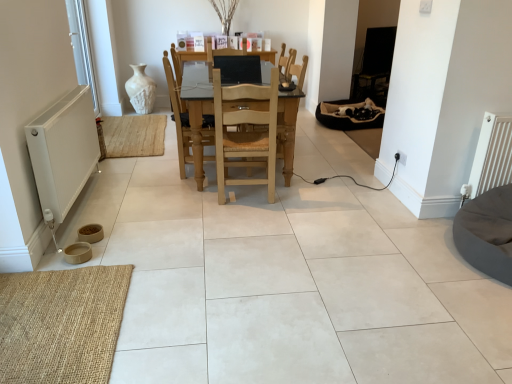
Question: Is the position of white plastic window screen at left less distant than that of burlap mat at lower left?

Choices:
 (A) yes
 (B) no

Answer: (B)

Question: From the image's perspective, is white plastic window screen at left above burlap mat at lower left?

Choices:
 (A) no
 (B) yes

Answer: (B)

Question: Considering the relative sizes of white plastic window screen at left and burlap mat at lower left in the image provided, is white plastic window screen at left smaller than burlap mat at lower left?

Choices:
 (A) yes
 (B) no

Answer: (B)

Question: Is white plastic window screen at left facing towards burlap mat at lower left?

Choices:
 (A) yes
 (B) no

Answer: (B)

Question: Is white plastic window screen at left outside of burlap mat at lower left?

Choices:
 (A) no
 (B) yes

Answer: (B)

Question: Is white plastic window screen at left taller than burlap mat at lower left?

Choices:
 (A) no
 (B) yes

Answer: (B)

Question: Is light wood table at center completely or partially outside of burlap mat at lower left?

Choices:
 (A) no
 (B) yes

Answer: (B)

Question: Does light wood table at center have a smaller size compared to burlap mat at lower left?

Choices:
 (A) no
 (B) yes

Answer: (A)

Question: Is light wood table at center next to burlap mat at lower left and touching it?

Choices:
 (A) yes
 (B) no

Answer: (B)

Question: Can you confirm if light wood table at center is positioned to the left of burlap mat at lower left?

Choices:
 (A) yes
 (B) no

Answer: (B)

Question: Could you tell me if light wood table at center is turned towards burlap mat at lower left?

Choices:
 (A) yes
 (B) no

Answer: (B)

Question: From a real-world perspective, is light wood table at center physically above burlap mat at lower left?

Choices:
 (A) yes
 (B) no

Answer: (A)

Question: Does natural wood/rattan chair at center, the 2th chair when ordered from left to right, have a lesser width compared to soft black fabric bean bag at center right, the first bean bag chair viewed from the top?

Choices:
 (A) yes
 (B) no

Answer: (A)